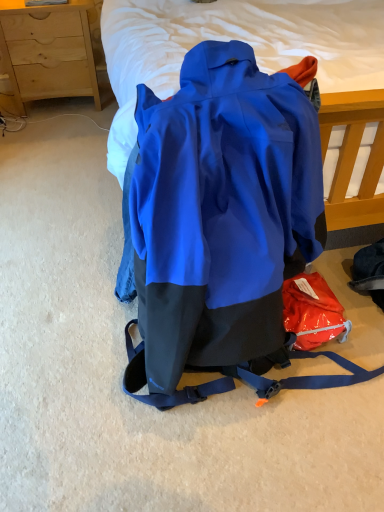
Question: Should I look upward or downward to see wooden chest of drawers at upper left?

Choices:
 (A) up
 (B) down

Answer: (A)

Question: From a real-world perspective, is blue matte backpack at center physically below wooden chest of drawers at upper left?

Choices:
 (A) yes
 (B) no

Answer: (B)

Question: From the image's perspective, is blue matte backpack at center above wooden chest of drawers at upper left?

Choices:
 (A) no
 (B) yes

Answer: (A)

Question: From a real-world perspective, is blue matte backpack at center located higher than wooden chest of drawers at upper left?

Choices:
 (A) no
 (B) yes

Answer: (B)

Question: Is blue matte backpack at center outside of wooden chest of drawers at upper left?

Choices:
 (A) no
 (B) yes

Answer: (B)

Question: Is blue matte backpack at center taller than wooden chest of drawers at upper left?

Choices:
 (A) no
 (B) yes

Answer: (B)

Question: Does blue matte backpack at center have a larger size compared to wooden chest of drawers at upper left?

Choices:
 (A) yes
 (B) no

Answer: (A)

Question: Is wooden chest of drawers at upper left not close to blue matte backpack at center?

Choices:
 (A) yes
 (B) no

Answer: (A)

Question: Is wooden chest of drawers at upper left facing away from blue matte backpack at center?

Choices:
 (A) no
 (B) yes

Answer: (A)

Question: Does wooden chest of drawers at upper left have a lesser height compared to blue matte backpack at center?

Choices:
 (A) yes
 (B) no

Answer: (A)

Question: From the image's perspective, does wooden chest of drawers at upper left appear higher than blue matte backpack at center?

Choices:
 (A) yes
 (B) no

Answer: (A)

Question: Could you tell me if wooden chest of drawers at upper left is turned towards blue matte backpack at center?

Choices:
 (A) yes
 (B) no

Answer: (A)

Question: Is wooden chest of drawers at upper left positioned in front of blue matte backpack at center?

Choices:
 (A) no
 (B) yes

Answer: (A)

Question: Is blue matte backpack at center bigger or smaller than wooden chest of drawers at upper left?

Choices:
 (A) small
 (B) big

Answer: (B)